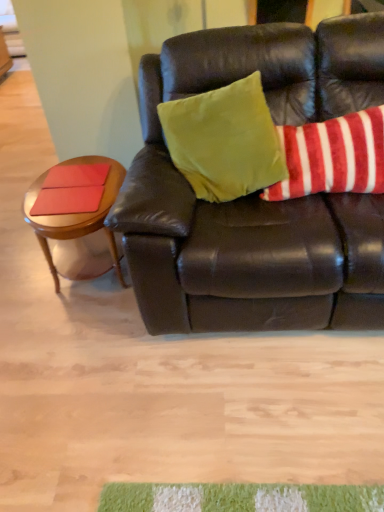
Question: In terms of height, does woodenwoodentable at left look taller or shorter compared to velvety green pillow at upper center, which is the first pillow in left-to-right order?

Choices:
 (A) tall
 (B) short

Answer: (B)

Question: Considering the positions of woodenwoodentable at left and velvety green pillow at upper center, arranged as the second pillow when viewed from the right, in the image, is woodenwoodentable at left wider or thinner than velvety green pillow at upper center, arranged as the second pillow when viewed from the right,?

Choices:
 (A) wide
 (B) thin

Answer: (A)

Question: Which object is the farthest from the woodenwoodentable at left?

Choices:
 (A) matte red pad at left, placed as the 2th pad when sorted from top to bottom
 (B) velvety green pillow at upper center, arranged as the second pillow when viewed from the right
 (C) red/white striped pillow at upper right, the second pillow when ordered from left to right
 (D) matte red pad at left, which ranks as the second pad in front-to-back order
 (E) matte brown leather couch at center

Answer: (C)

Question: Estimate the real-world distances between objects in this image. Which object is closer to the matte brown leather couch at center?

Choices:
 (A) woodenwoodentable at left
 (B) matte red pad at left, placed as the 1th pad when sorted from front to back
 (C) matte red pad at left, the first pad in the back-to-front sequence
 (D) red/white striped pillow at upper right, the second pillow when ordered from left to right
 (E) velvety green pillow at upper center, which is the first pillow in left-to-right order

Answer: (D)